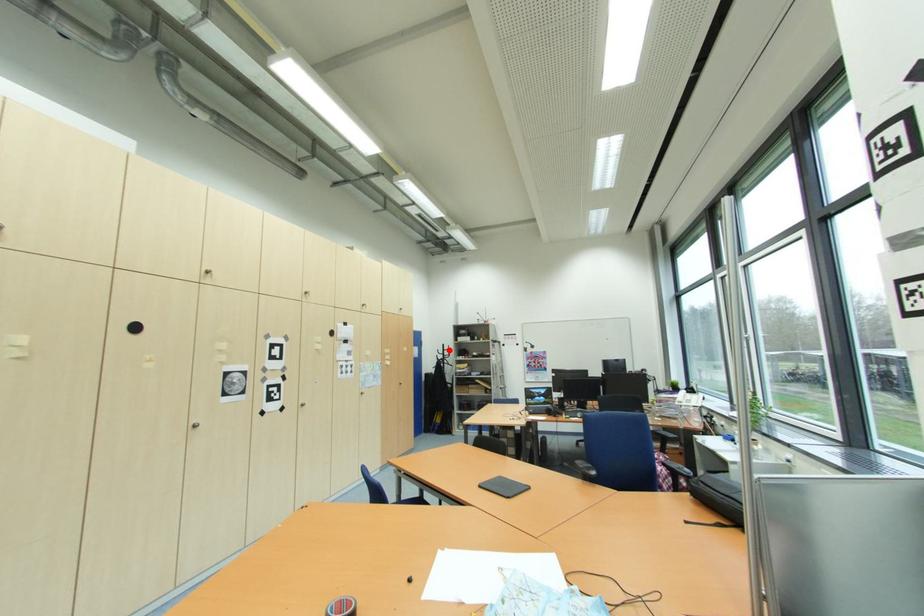
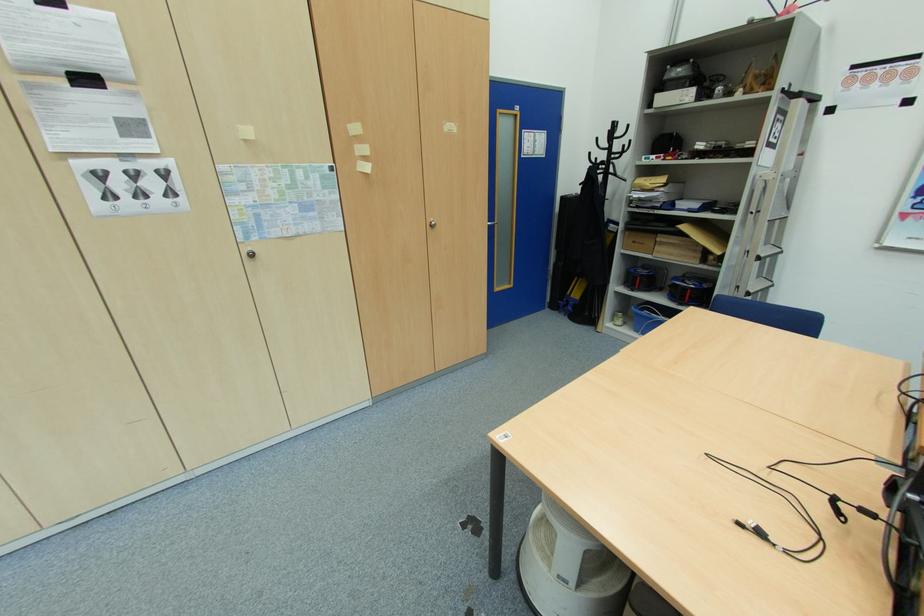
Question: I am providing you with two images of the same scene from different viewpoints. In image1, a red point is highlighted. Considering the same 3D point in image2, which of the following is correct?

Choices:
 (A) It is closer
 (B) It is farther

Answer: (A)